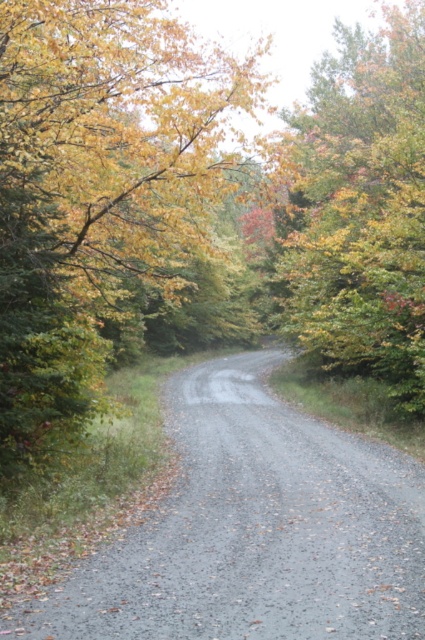
You are a hiker trying to follow the gray gravel path at center in this forest scene. You notice autumn leaves at upper right nearby. Which of the two has a larger size in the image?

The autumn leaves at upper right are larger in size compared to the gray gravel path at center.